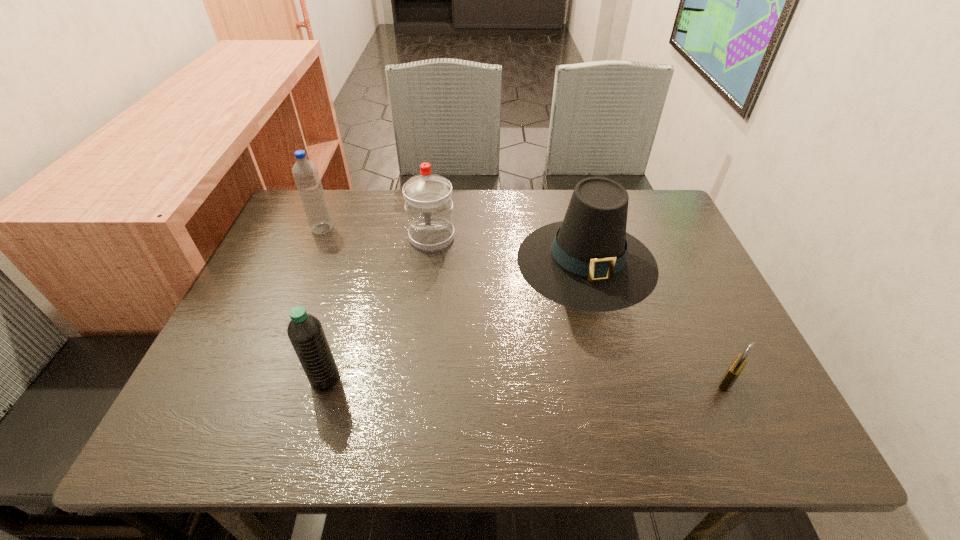
In the image, there is a desktop. Where is `vacant space at the left edge`? This screenshot has width=960, height=540. vacant space at the left edge is located at coordinates (263, 263).

Locate an element on the screen. free space at the right edge of the desktop is located at coordinates (719, 353).

In the image, there is a desktop. Where is `vacant space at the far left corner`? This screenshot has height=540, width=960. vacant space at the far left corner is located at coordinates (300, 207).

The image size is (960, 540). In the image, there is a desktop. Find the location of `vacant space at the far right corner`. vacant space at the far right corner is located at coordinates (661, 207).

In the image, there is a desktop. At what (x,y) coordinates should I click in order to perform the action: click on vacant space at the near right corner. Please return your answer as a coordinate pair (x, y). Looking at the image, I should click on (723, 429).

What are the coordinates of `free space between the padlock and the second object from right to left` in the screenshot? It's located at (658, 321).

In order to click on free point between the fourth object from right to left and the rightmost object in this screenshot , I will do `click(526, 379)`.

The height and width of the screenshot is (540, 960). What are the coordinates of `free space between the leftmost object and the rightmost object` in the screenshot? It's located at (525, 305).

Where is `unoccupied position between the third object from right to left and the second object from right to left`? The width and height of the screenshot is (960, 540). unoccupied position between the third object from right to left and the second object from right to left is located at coordinates (509, 249).

Where is `vacant space that's between the second object from left to right and the padlock`? This screenshot has height=540, width=960. vacant space that's between the second object from left to right and the padlock is located at coordinates (526, 379).